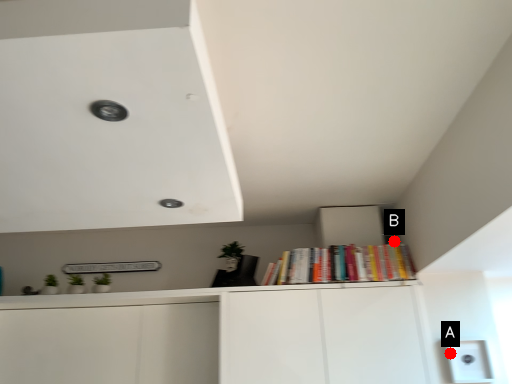
Question: Two points are circled on the image, labeled by A and B beside each circle. Which point appears closest to the camera in this image?

Choices:
 (A) A is closer
 (B) B is closer

Answer: (A)